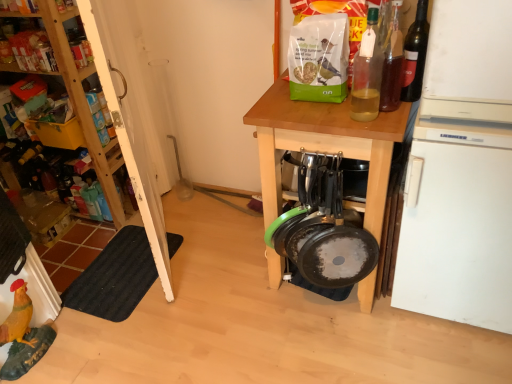
Find the location of a particular element. The height and width of the screenshot is (384, 512). vacant area in front of dark glass bottle at upper right, the 1th bottle in the right-to-left sequence is located at coordinates (396, 122).